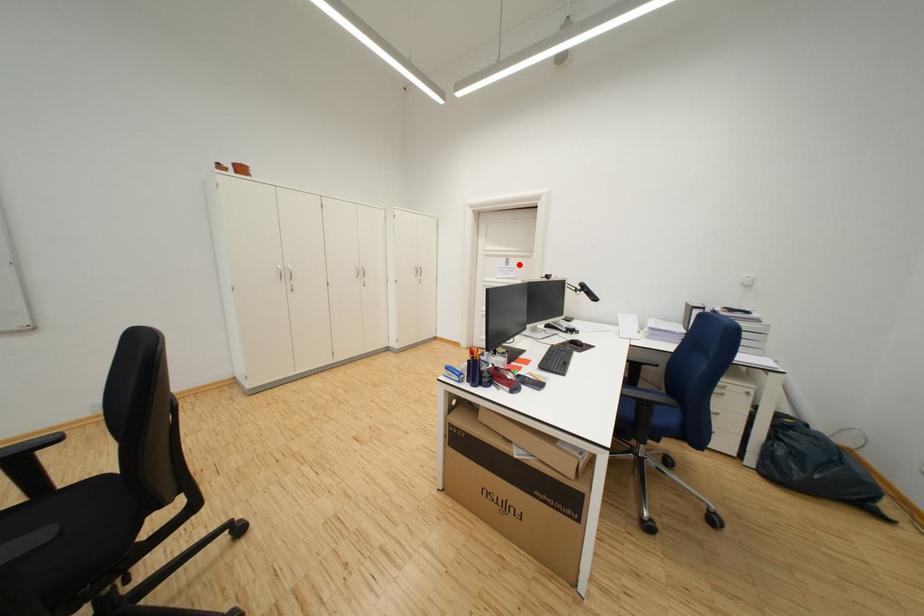
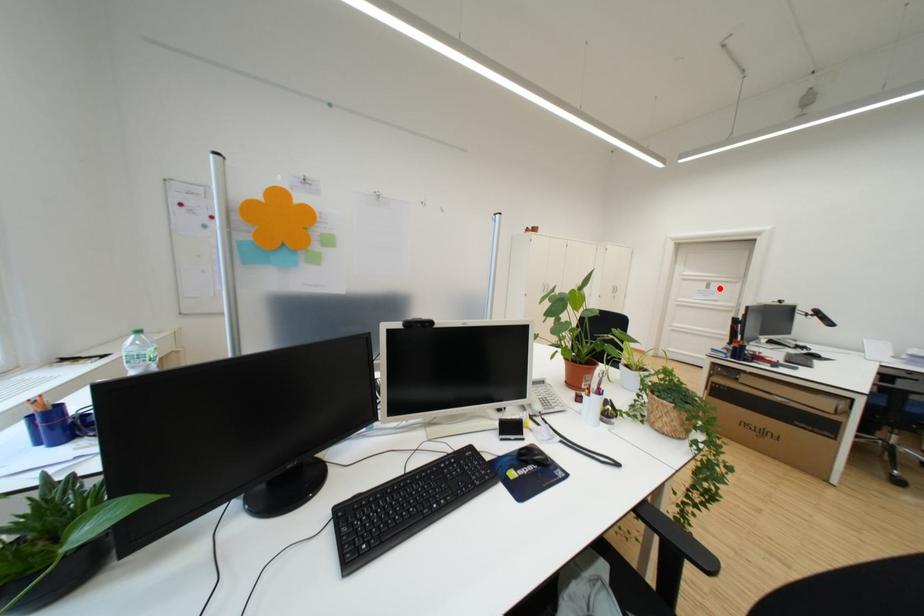
I am providing you with two images of the same scene from different viewpoints. A red point is marked on the first image and another point is marked on the second image. Does the point marked in image1 correspond to the same location as the one in image2?

Yes